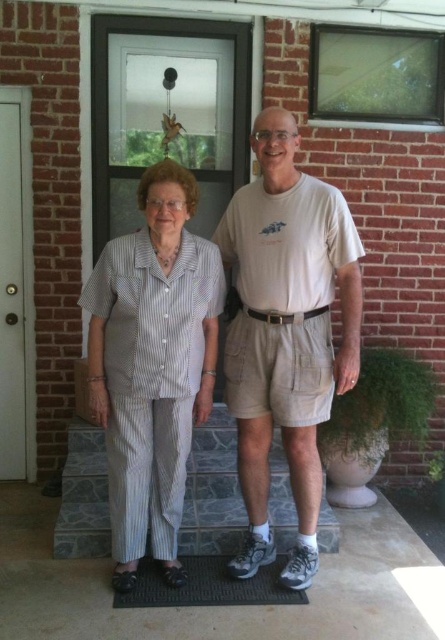
Question: Which object is closer to the camera taking this photo?

Choices:
 (A) stonework at center
 (B) white striped pajamas at center
 (C) white glossy door at left

Answer: (B)

Question: Does white glossy door at left have a lesser width compared to green rubber doormat at lower center?

Choices:
 (A) yes
 (B) no

Answer: (A)

Question: Is white glossy door at left thinner than green rubber doormat at lower center?

Choices:
 (A) no
 (B) yes

Answer: (B)

Question: Is stonework at center below green rubber doormat at lower center?

Choices:
 (A) no
 (B) yes

Answer: (A)

Question: Among these objects, which one is farthest from the camera?

Choices:
 (A) white striped pajamas at center
 (B) white cotton t-shirt at center
 (C) stonework at center

Answer: (C)

Question: Which point is farther from the camera taking this photo?

Choices:
 (A) (222, 440)
 (B) (153, 561)

Answer: (A)